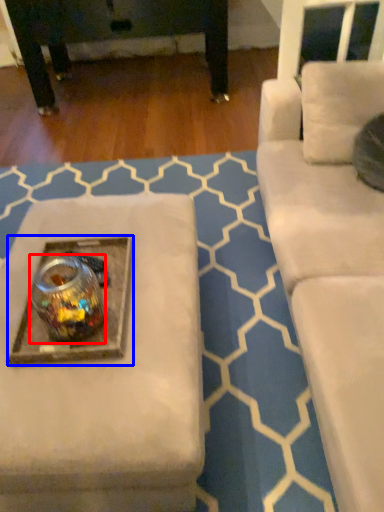
Question: Among these objects, which one is farthest to the camera, beverage (highlighted by a red box) or round table (highlighted by a blue box)?

Choices:
 (A) beverage
 (B) round table

Answer: (B)